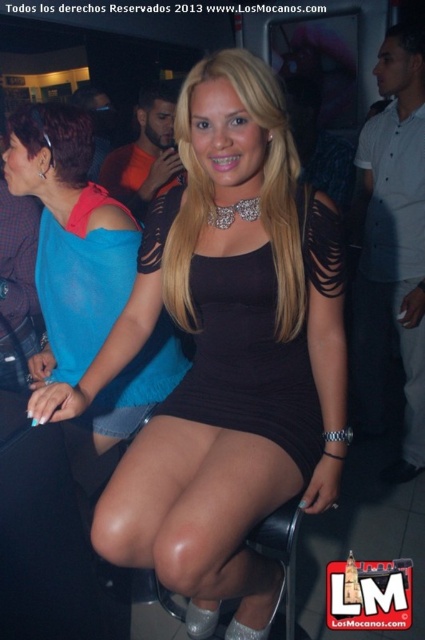
You are a fashion designer observing the scene. You need to determine which of the two outfits, the blue sheer top at upper left or the black ribbed dress at center, would require more fabric to produce. Based on their sizes as seen in the image, which one would need more material?

The blue sheer top at upper left is larger in size than the black ribbed dress at center, so it would require more fabric to produce.